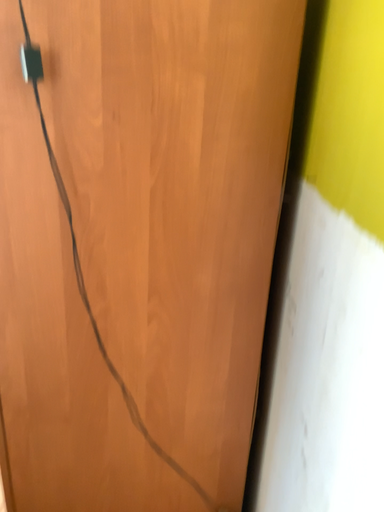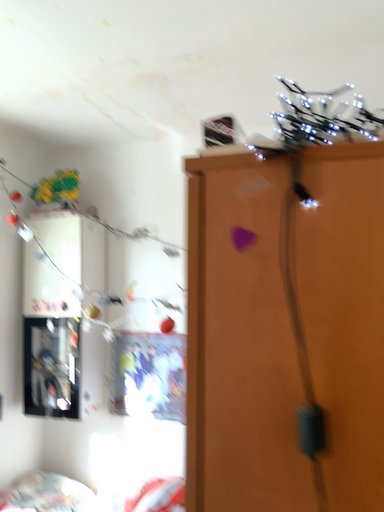
Question: How did the camera likely rotate when shooting the video?

Choices:
 (A) rotated upward
 (B) rotated downward

Answer: (A)